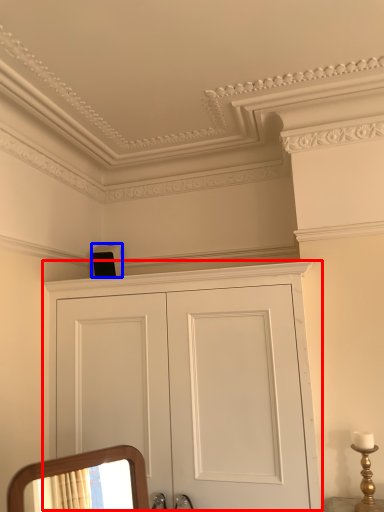
Question: Which object appears farthest to the camera in this image, cupboard (highlighted by a red box) or speaker (highlighted by a blue box)?

Choices:
 (A) cupboard
 (B) speaker

Answer: (B)